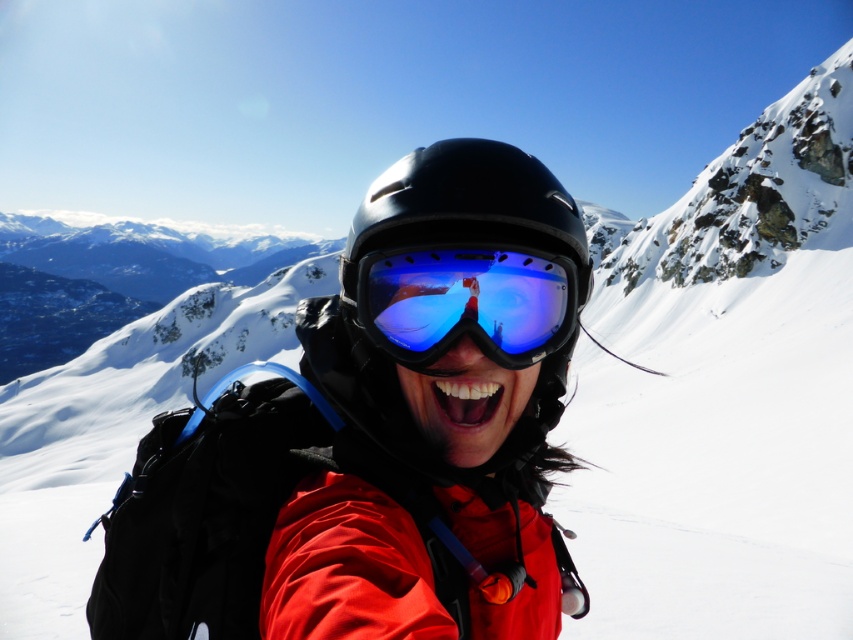
Question: Can you confirm if blue reflective lens at center is thinner than black matte helmet at center?

Choices:
 (A) no
 (B) yes

Answer: (B)

Question: Which of the following is the closest to the observer?

Choices:
 (A) black matte helmet at center
 (B) blue reflective lens at center

Answer: (A)

Question: Is blue reflective lens at center positioned at the back of black matte helmet at center?

Choices:
 (A) no
 (B) yes

Answer: (B)

Question: Can you confirm if blue reflective lens at center is positioned to the right of black matte helmet at center?

Choices:
 (A) no
 (B) yes

Answer: (A)